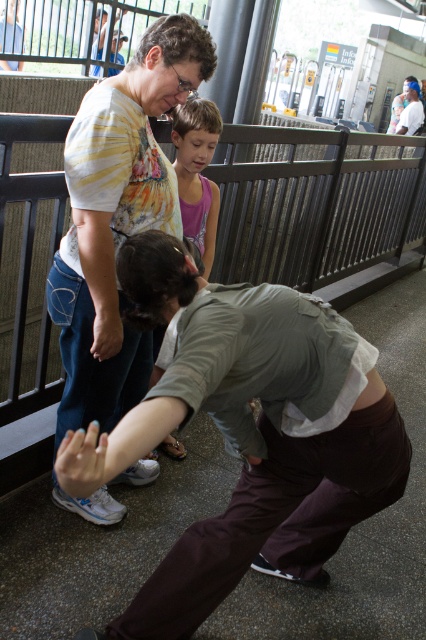
Does brown cotton pants at lower center have a lesser width compared to pink fabric shirt at center?

Incorrect, brown cotton pants at lower center's width is not less than pink fabric shirt at center's.

Does point (253, 480) come farther from viewer compared to point (201, 221)?

That is False.

I want to click on brown cotton pants at lower center, so click(245, 433).

Is point (187, 45) positioned after point (218, 124)?

No, (187, 45) is in front of (218, 124).

The image size is (426, 640). I want to click on striped cotton shirt at upper left, so click(118, 218).

Does metallic gray fence at upper center have a smaller size compared to pink fabric shirt at center?

Actually, metallic gray fence at upper center might be larger than pink fabric shirt at center.

Does point (284, 234) lie behind point (189, 118)?

That is True.

The image size is (426, 640). I want to click on metallic gray fence at upper center, so coord(316,208).